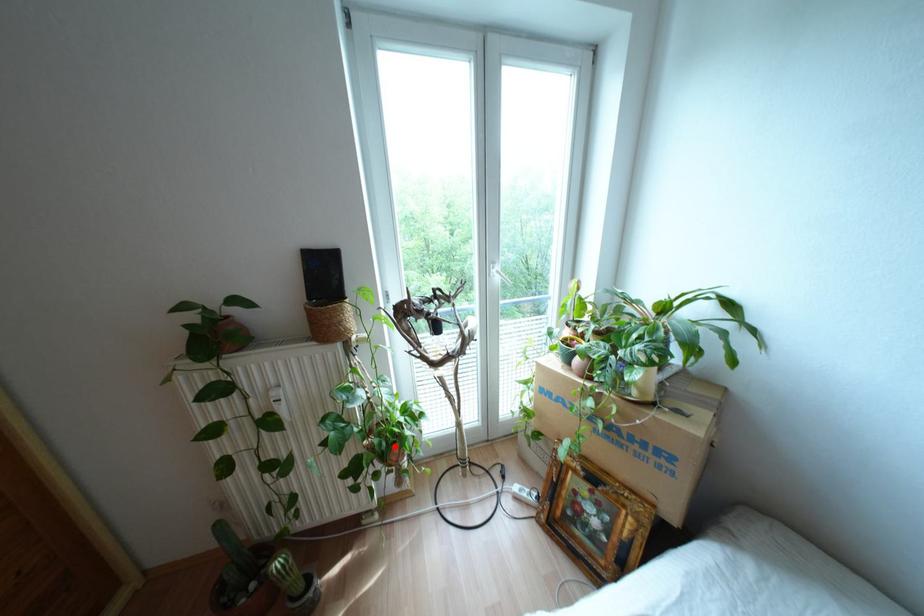
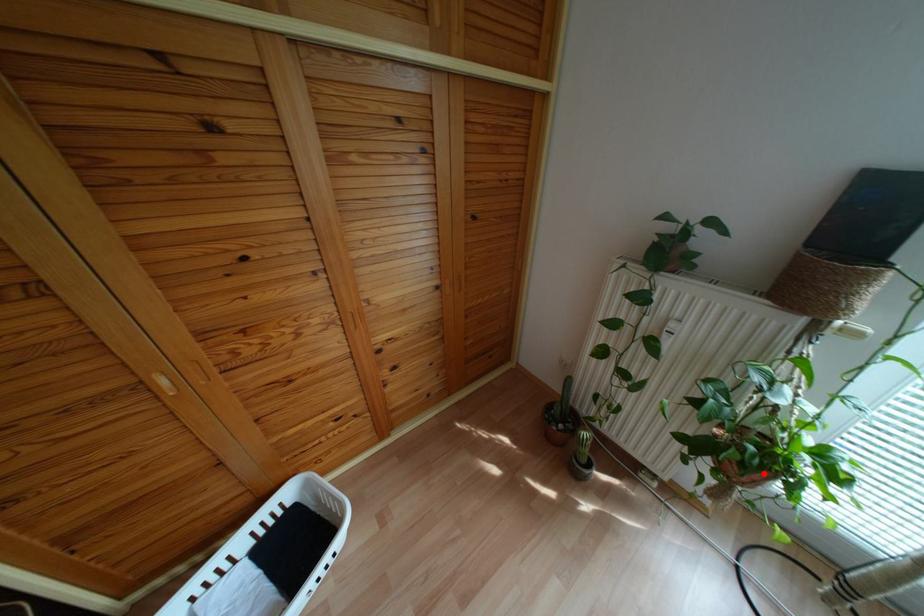
I am providing you with two images of the same scene from different viewpoints. A red point is marked on the first image and another point is marked on the second image. Do the highlighted points in image1 and image2 indicate the same real-world spot?

Yes